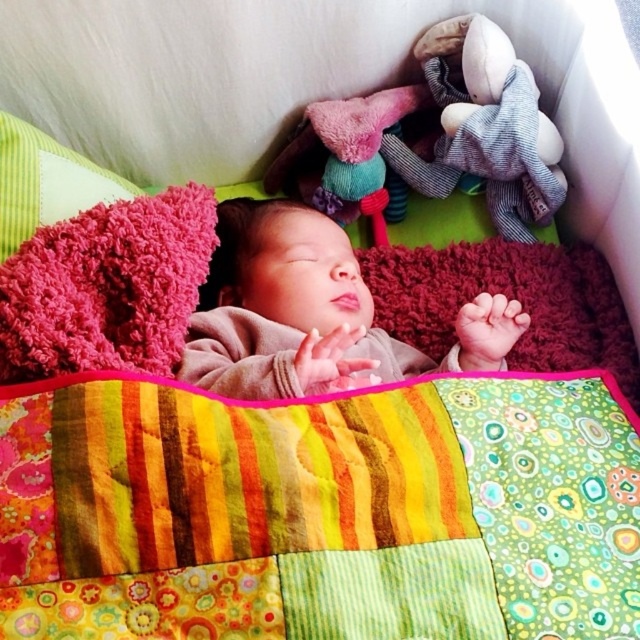
You are a parent checking on your baby. You see the soft pink blanket at center and the soft plush toy at upper right. How far apart are these two items from each other?

The soft pink blanket at center is 12.78 inches away from the soft plush toy at upper right.

You need to place a small stuffed animal on the multicolored patchwork quilt at center and the fuzzy pink pillow at upper left. Which surface can accommodate the stuffed animal more comfortably?

The multicolored patchwork quilt at center might be wider than the fuzzy pink pillow at upper left, so the stuffed animal can be placed more comfortably on the multicolored patchwork quilt at center.

You are a nurse checking on a baby in the nursery. The baby is in a crib with a multicolored patchwork quilt at center. According to the nursery safety guidelines, all loose items must be kept at least 12 inches away from the baby to prevent suffocation. The coordinates given are in a normalized system where the crib is represented as a rectangle from point A at the bottom left corner at coordinates 0.0,0.0 to point B at the top right corner at coordinates 1.0,1.0. Can you determine if the multicolored patc

The multicolored patchwork quilt at center is located at point (321, 509). Since the crib spans from (0, 0) to (639, 639), the quilt is positioned at the center area. However, the safety guideline requires loose items to be at least 12 inches away from the baby. Without knowing the actual size of the crib or the distance from the baby, it is impossible to determine compliance with the guideline based solely on the coordinates provided. Please measure the physical distance for accurate assessment.